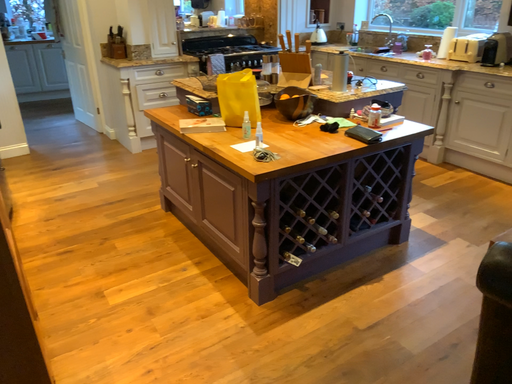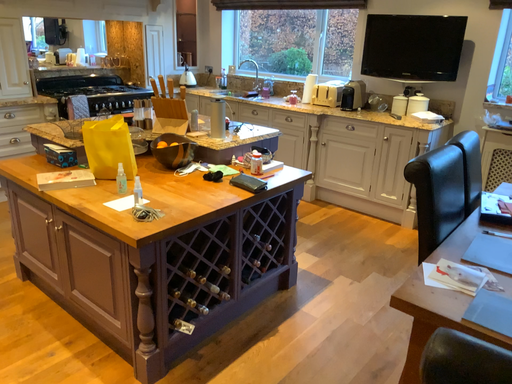
Question: How did the camera likely rotate when shooting the video?

Choices:
 (A) rotated left
 (B) rotated right

Answer: (B)